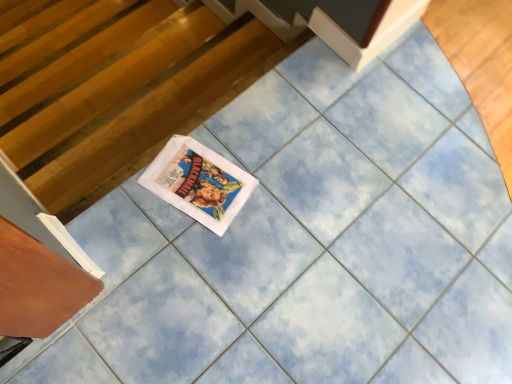
Question: From their relative heights in the image, would you say wooden drawer at lower left is taller or shorter than white paper comic book at center?

Choices:
 (A) short
 (B) tall

Answer: (B)

Question: Is point (31, 251) positioned closer to the camera than point (216, 172)?

Choices:
 (A) closer
 (B) farther

Answer: (A)

Question: Which of these objects is positioned closest to the wooden drawer at lower left?

Choices:
 (A) wooden at left
 (B) white paper comic book at center

Answer: (B)

Question: Which object is positioned farthest from the white paper comic book at center?

Choices:
 (A) wooden drawer at lower left
 (B) wooden at left

Answer: (B)